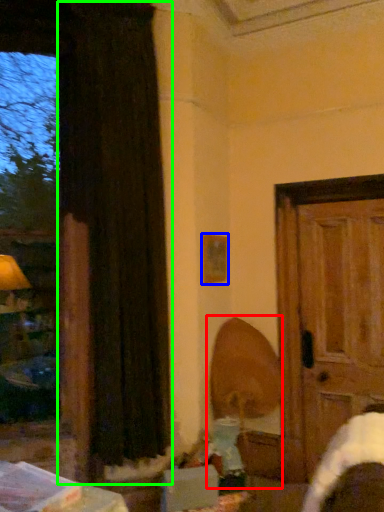
Question: Which object is positioned closest to swivel chair (highlighted by a red box)? Select from picture frame (highlighted by a blue box) and curtain (highlighted by a green box).

Choices:
 (A) picture frame
 (B) curtain

Answer: (A)